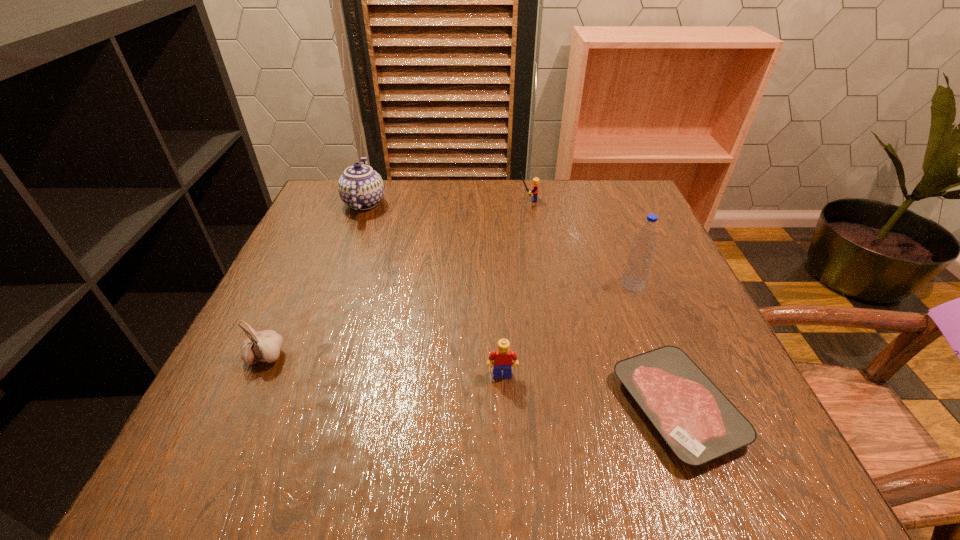
At what (x,y) coordinates should I click in order to perform the action: click on chinaware positioned at the left edge. Please return your answer as a coordinate pair (x, y). Looking at the image, I should click on (360, 187).

Where is `garlic that is at the left edge`? The image size is (960, 540). garlic that is at the left edge is located at coordinates coord(265,346).

Find the location of a particular element. The height and width of the screenshot is (540, 960). water bottle situated at the right edge is located at coordinates 637,268.

This screenshot has width=960, height=540. I want to click on steak at the right edge, so click(699, 423).

Find the location of `object situated at the far left corner`. object situated at the far left corner is located at coordinates (360, 187).

Find the location of a particular element. The width and height of the screenshot is (960, 540). object present at the near right corner is located at coordinates (699, 423).

This screenshot has height=540, width=960. What are the coordinates of `free spot at the far edge of the desktop` in the screenshot? It's located at (464, 189).

The image size is (960, 540). I want to click on vacant area at the near edge, so click(x=314, y=441).

This screenshot has height=540, width=960. Identify the location of free space at the left edge. (330, 256).

At what (x,y) coordinates should I click in order to perform the action: click on vacant area at the right edge. Please return your answer as a coordinate pair (x, y). This screenshot has width=960, height=540. Looking at the image, I should click on (634, 312).